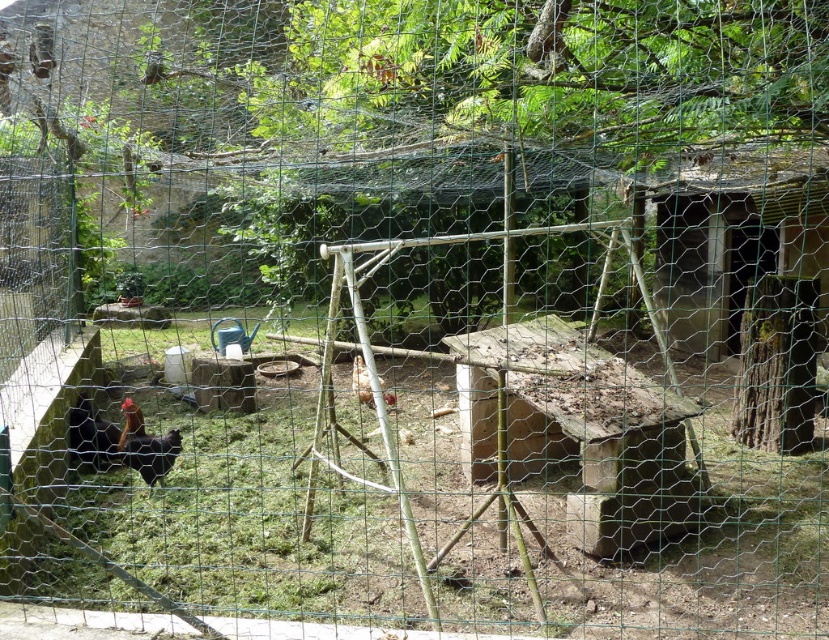
You are standing in the fenced outdoor area and want to locate two specific points marked in the scene. Which of the two points, point (137, 417) or point (351, 372), is closer to you?

Point (137, 417) is closer to the viewer than point (351, 372).

You are a farmer checking the health of your chickens. You notice the black matte chicken at lower left and the brown matte chicken at center. Which chicken appears to be in better health based on their body condition?

The brown matte chicken at center appears to be in better health because it is thicker than the black matte chicken at lower left.